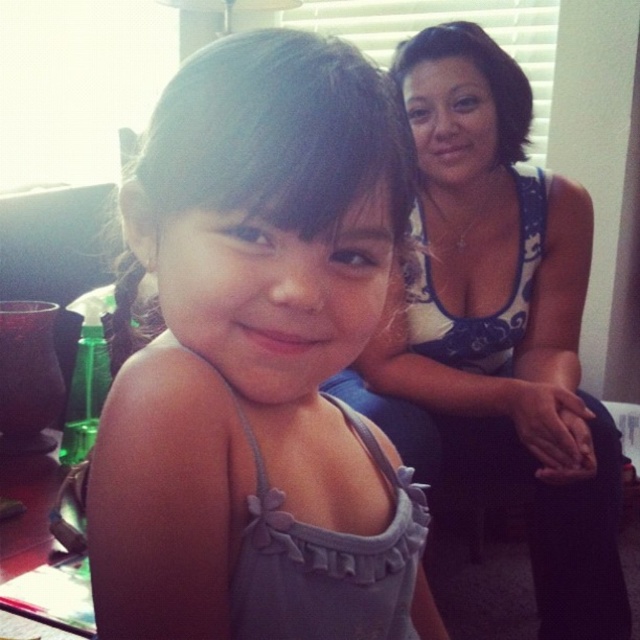
Question: Is matte gray tank top at center in front of white floral tank top at upper right?

Choices:
 (A) no
 (B) yes

Answer: (B)

Question: Does matte gray tank top at center lie behind white floral tank top at upper right?

Choices:
 (A) no
 (B) yes

Answer: (A)

Question: Among these points, which one is farthest from the camera?

Choices:
 (A) (152, 161)
 (B) (428, 353)

Answer: (B)

Question: Among these objects, which one is farthest from the camera?

Choices:
 (A) white floral tank top at upper right
 (B) matte gray tank top at center

Answer: (A)

Question: Among these points, which one is nearest to the camera?

Choices:
 (A) (604, 531)
 (B) (209, 72)

Answer: (B)

Question: Considering the relative positions of matte gray tank top at center and white floral tank top at upper right in the image provided, where is matte gray tank top at center located with respect to white floral tank top at upper right?

Choices:
 (A) below
 (B) above

Answer: (A)